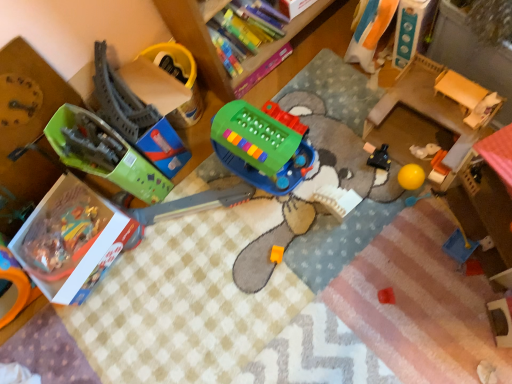
This screenshot has height=384, width=512. I want to click on vacant space to the left of green plastic toy at center, arranged as the 4th toy when viewed from the right, so click(x=204, y=218).